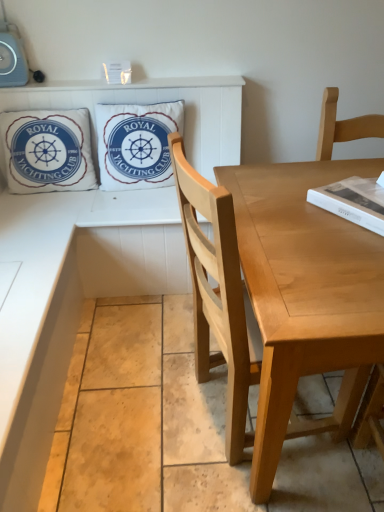
Question: From the image's perspective, is white cotton pillow at upper left, the first pillow from the left, above white matte book at upper right?

Choices:
 (A) yes
 (B) no

Answer: (A)

Question: From a real-world perspective, is white cotton pillow at upper left, the first pillow from the left, physically below white matte book at upper right?

Choices:
 (A) no
 (B) yes

Answer: (B)

Question: Can you confirm if white cotton pillow at upper left, the first pillow from the left, is bigger than white matte book at upper right?

Choices:
 (A) yes
 (B) no

Answer: (A)

Question: Does white cotton pillow at upper left, the first pillow from the left, come in front of white matte book at upper right?

Choices:
 (A) yes
 (B) no

Answer: (B)

Question: Is the depth of white cotton pillow at upper left, the first pillow from the left, greater than that of white matte book at upper right?

Choices:
 (A) yes
 (B) no

Answer: (A)

Question: Considering the positions of point (357, 188) and point (206, 283), is point (357, 188) closer or farther from the camera than point (206, 283)?

Choices:
 (A) farther
 (B) closer

Answer: (A)

Question: Is white matte book at upper right taller or shorter than light brown wood chair at right?

Choices:
 (A) short
 (B) tall

Answer: (A)

Question: In terms of width, does white matte book at upper right look wider or thinner when compared to light brown wood chair at right?

Choices:
 (A) thin
 (B) wide

Answer: (A)

Question: Is white matte book at upper right inside or outside of light brown wood chair at right?

Choices:
 (A) inside
 (B) outside

Answer: (B)

Question: Based on their sizes in the image, would you say white matte book at upper right is bigger or smaller than white cotton pillow at upper left, the first pillow from the left?

Choices:
 (A) big
 (B) small

Answer: (B)

Question: From the image's perspective, is white matte book at upper right positioned above or below white cotton pillow at upper left, the first pillow from the left?

Choices:
 (A) above
 (B) below

Answer: (B)

Question: Do you think white matte book at upper right is within white cotton pillow at upper left, the first pillow from the left, or outside of it?

Choices:
 (A) inside
 (B) outside

Answer: (B)

Question: From a real-world perspective, relative to white cotton pillow at upper left, the first pillow from the left, is white matte book at upper right vertically above or below?

Choices:
 (A) above
 (B) below

Answer: (A)

Question: Considering the relative positions of wooden table at lower left and white matte book at upper right in the image provided, is wooden table at lower left to the left or to the right of white matte book at upper right?

Choices:
 (A) left
 (B) right

Answer: (A)

Question: Considering their positions, is wooden table at lower left located in front of or behind white matte book at upper right?

Choices:
 (A) front
 (B) behind

Answer: (B)